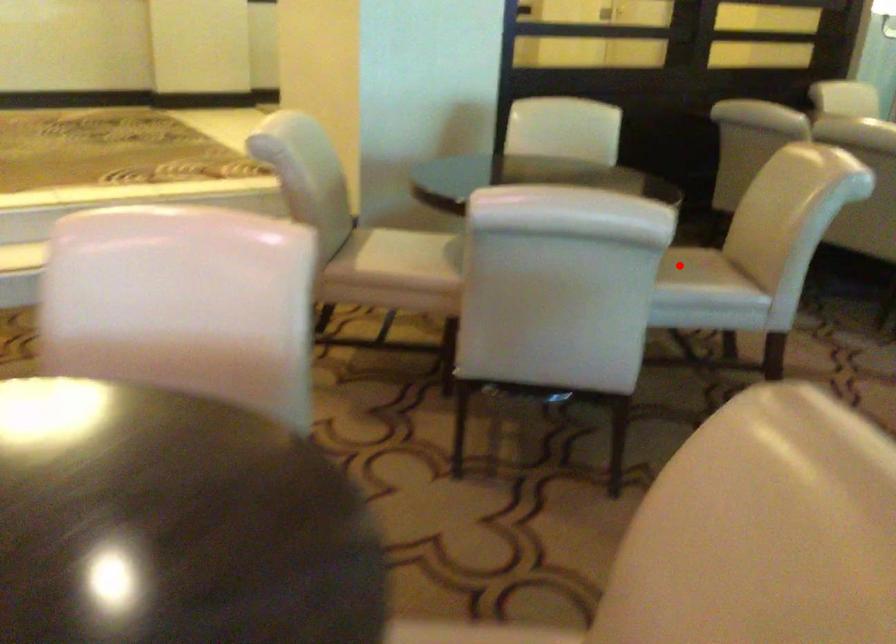
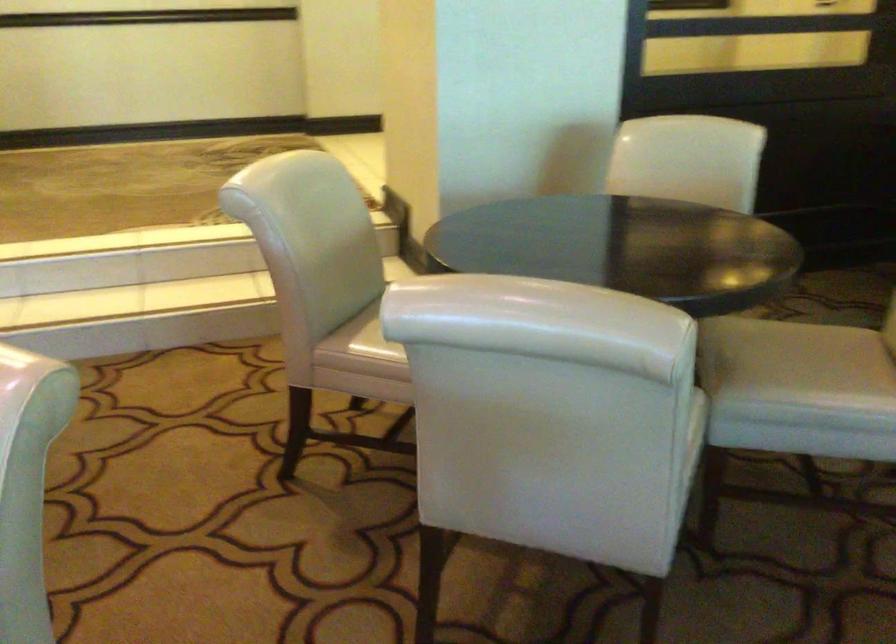
Find the pixel in the second image that matches the highlighted location in the first image.

(796, 363)